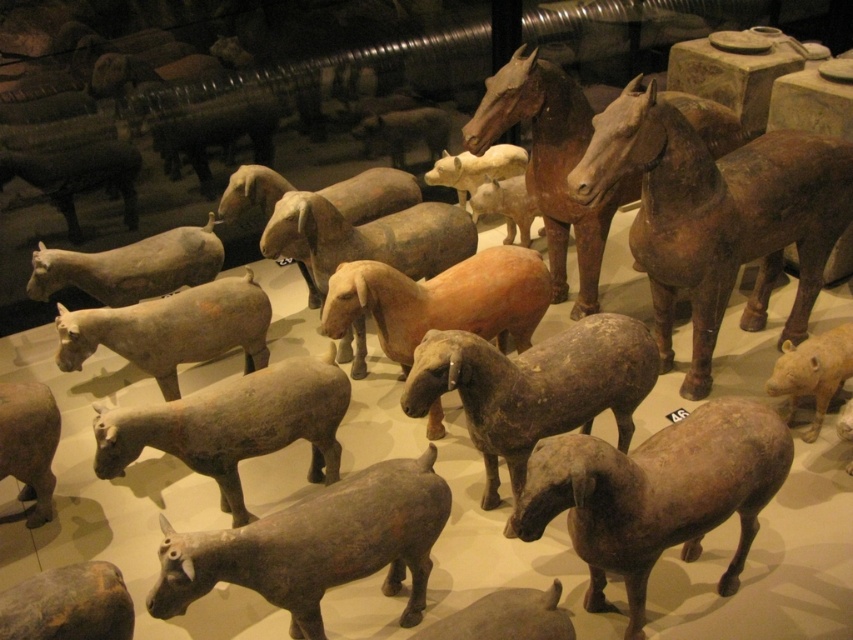
Question: Is matte gray sheep at center thinner than matte gray cow at lower left?

Choices:
 (A) yes
 (B) no

Answer: (B)

Question: Which is nearer to the brown matte horse at center?

Choices:
 (A) matte gray cow at lower left
 (B) matte gray sheep at lower left
 (C) earthenware sheep at center
 (D) matte gray sheep at center

Answer: (D)

Question: Which point appears closest to the camera in this image?

Choices:
 (A) tap(200, 584)
 (B) tap(692, 420)
 (C) tap(33, 604)

Answer: (C)

Question: Is matte clay sheep at center to the right of brown matte horse at center from the viewer's perspective?

Choices:
 (A) no
 (B) yes

Answer: (A)

Question: Does matte clay sheep at center come behind matte gray cow at lower left?

Choices:
 (A) no
 (B) yes

Answer: (B)

Question: Estimate the real-world distances between objects in this image. Which object is farther from the matte gray sheep at center?

Choices:
 (A) matte gray sheep at lower left
 (B) matte clay sheep at center

Answer: (A)